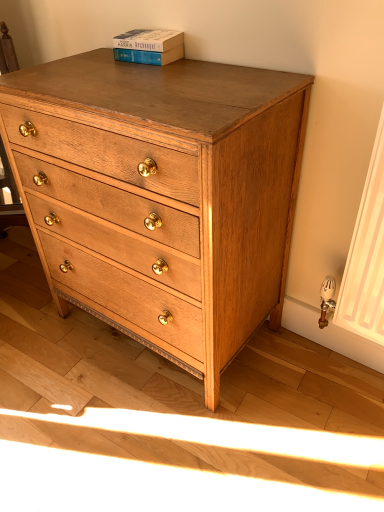
Question: Do you think blue cardboard book at upper center is within natural wood chest of drawers at center, or outside of it?

Choices:
 (A) inside
 (B) outside

Answer: (B)

Question: Based on their positions, is blue cardboard book at upper center located to the left or right of natural wood chest of drawers at center?

Choices:
 (A) right
 (B) left

Answer: (B)

Question: Looking at the image, does blue cardboard book at upper center seem bigger or smaller compared to natural wood chest of drawers at center?

Choices:
 (A) small
 (B) big

Answer: (A)

Question: Is natural wood chest of drawers at center taller or shorter than blue cardboard book at upper center?

Choices:
 (A) short
 (B) tall

Answer: (B)

Question: Is natural wood chest of drawers at center inside or outside of blue cardboard book at upper center?

Choices:
 (A) outside
 (B) inside

Answer: (A)

Question: Considering the positions of point (139, 155) and point (162, 55), is point (139, 155) closer or farther from the camera than point (162, 55)?

Choices:
 (A) farther
 (B) closer

Answer: (B)

Question: Based on their sizes in the image, would you say natural wood chest of drawers at center is bigger or smaller than blue cardboard book at upper center?

Choices:
 (A) big
 (B) small

Answer: (A)